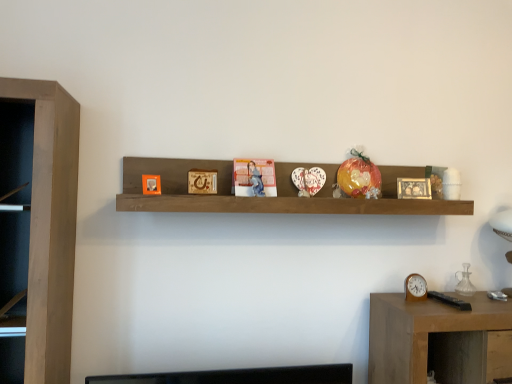
Question: Is wooden clock at right touching wooden shelf at center?

Choices:
 (A) yes
 (B) no

Answer: (B)

Question: Can you confirm if wooden clock at right is shorter than wooden shelf at center?

Choices:
 (A) yes
 (B) no

Answer: (A)

Question: Does wooden clock at right have a smaller size compared to wooden shelf at center?

Choices:
 (A) no
 (B) yes

Answer: (B)

Question: Is wooden clock at right to the right of wooden shelf at center from the viewer's perspective?

Choices:
 (A) no
 (B) yes

Answer: (B)

Question: From a real-world perspective, is wooden clock at right physically below wooden shelf at center?

Choices:
 (A) yes
 (B) no

Answer: (A)

Question: In terms of size, does matte plastic calendar at center appear bigger or smaller than translucent plastic toy at center?

Choices:
 (A) big
 (B) small

Answer: (B)

Question: Which is correct: matte plastic calendar at center is inside translucent plastic toy at center, or outside of it?

Choices:
 (A) outside
 (B) inside

Answer: (A)

Question: In terms of width, does matte plastic calendar at center look wider or thinner when compared to translucent plastic toy at center?

Choices:
 (A) wide
 (B) thin

Answer: (A)

Question: Based on their positions, is matte plastic calendar at center located to the left or right of translucent plastic toy at center?

Choices:
 (A) left
 (B) right

Answer: (A)

Question: Which is correct: wooden picture frame at center, which appears as the 1th picture frame when viewed from the right, is inside matte plastic calendar at center, or outside of it?

Choices:
 (A) inside
 (B) outside

Answer: (B)

Question: Visually, is wooden picture frame at center, the third picture frame positioned from the front, positioned to the left or to the right of matte plastic calendar at center?

Choices:
 (A) left
 (B) right

Answer: (B)

Question: Is wooden picture frame at center, which appears as the 1th picture frame when viewed from the right, bigger or smaller than matte plastic calendar at center?

Choices:
 (A) big
 (B) small

Answer: (B)

Question: From their relative heights in the image, would you say wooden picture frame at center, marked as the first picture frame in a back-to-front arrangement, is taller or shorter than matte plastic calendar at center?

Choices:
 (A) tall
 (B) short

Answer: (B)

Question: Looking at their shapes, would you say matte plastic calendar at center is wider or thinner than wooden table at lower right?

Choices:
 (A) thin
 (B) wide

Answer: (A)

Question: From a real-world perspective, relative to wooden table at lower right, is matte plastic calendar at center vertically above or below?

Choices:
 (A) above
 (B) below

Answer: (A)